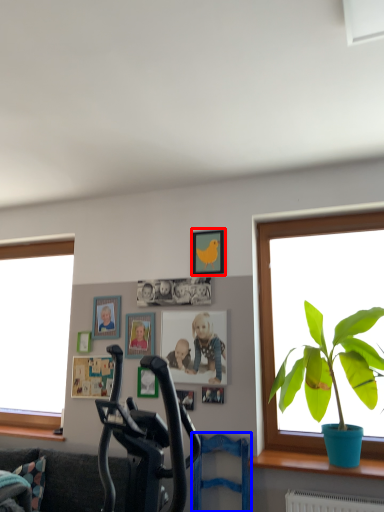
Question: Which of the following is the farthest to the observer, picture frame (highlighted by a red box) or swivel chair (highlighted by a blue box)?

Choices:
 (A) picture frame
 (B) swivel chair

Answer: (A)